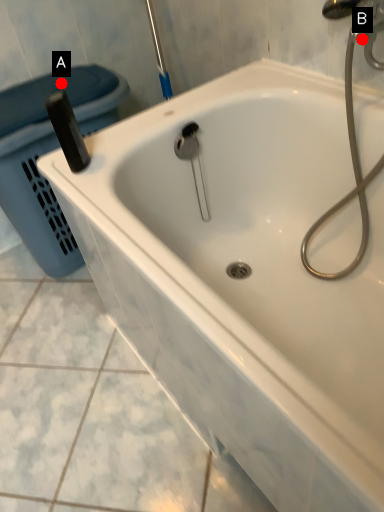
Question: Two points are circled on the image, labeled by A and B beside each circle. Which point appears farthest from the camera in this image?

Choices:
 (A) A is further
 (B) B is further

Answer: (A)